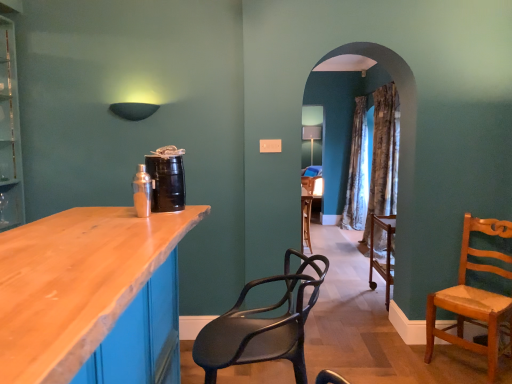
Question: Is patterned fabric curtain at center outside matte black chair at center, which is counted as the first chair, starting from the left?

Choices:
 (A) yes
 (B) no

Answer: (A)

Question: Is patterned fabric curtain at center positioned with its back to matte black chair at center, which is the first chair from front to back?

Choices:
 (A) no
 (B) yes

Answer: (A)

Question: Is patterned fabric curtain at center taller than matte black chair at center, which is the first chair from front to back?

Choices:
 (A) no
 (B) yes

Answer: (B)

Question: From the image's perspective, is patterned fabric curtain at center under matte black chair at center, which is the first chair from front to back?

Choices:
 (A) no
 (B) yes

Answer: (A)

Question: Is patterned fabric curtain at center at the left side of matte black chair at center, which is counted as the first chair, starting from the left?

Choices:
 (A) yes
 (B) no

Answer: (B)

Question: Is patterned fabric curtain at center to the left or to the right of light brown wooden chair at right, arranged as the 1th chair when viewed from the back, in the image?

Choices:
 (A) right
 (B) left

Answer: (A)

Question: Considering their positions, is patterned fabric curtain at center located in front of or behind light brown wooden chair at right, the 2th chair from the left?

Choices:
 (A) front
 (B) behind

Answer: (B)

Question: Looking at their shapes, would you say patterned fabric curtain at center is wider or thinner than light brown wooden chair at right, acting as the second chair starting from the front?

Choices:
 (A) wide
 (B) thin

Answer: (B)

Question: Is patterned fabric curtain at center situated inside light brown wooden chair at right, acting as the second chair starting from the front, or outside?

Choices:
 (A) inside
 (B) outside

Answer: (B)

Question: Would you say light brown wooden chair at right, marked as the 1th chair in a right-to-left arrangement, is inside or outside matte black chair at center, the second chair positioned from the right?

Choices:
 (A) outside
 (B) inside

Answer: (A)

Question: From the image's perspective, is light brown wooden chair at right, acting as the second chair starting from the front, located above or below matte black chair at center, which is counted as the first chair, starting from the left?

Choices:
 (A) above
 (B) below

Answer: (B)

Question: Is point (493, 332) positioned closer to the camera than point (279, 322)?

Choices:
 (A) farther
 (B) closer

Answer: (A)

Question: Based on their sizes in the image, would you say light brown wooden chair at right, the 2th chair from the left, is bigger or smaller than matte black chair at center, which is counted as the 2th chair, starting from the back?

Choices:
 (A) big
 (B) small

Answer: (A)

Question: Considering the positions of point (253, 311) and point (367, 213), is point (253, 311) closer or farther from the camera than point (367, 213)?

Choices:
 (A) closer
 (B) farther

Answer: (A)

Question: In terms of height, does matte black chair at center, the second chair positioned from the right, look taller or shorter compared to patterned fabric curtain at center?

Choices:
 (A) tall
 (B) short

Answer: (B)